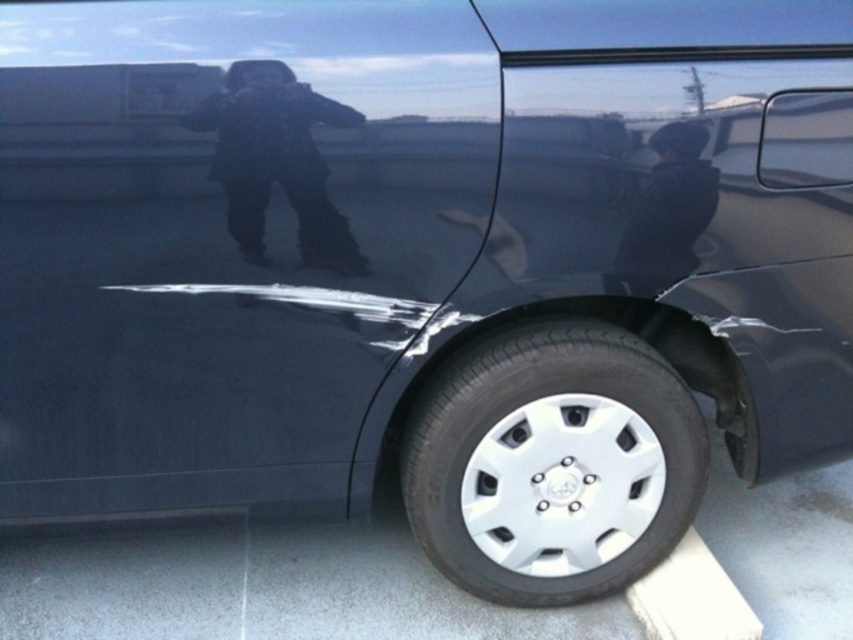
Question: Which object is farther from the camera taking this photo?

Choices:
 (A) silver metallic wheel at lower center
 (B) black textured coat at upper center

Answer: (A)

Question: From the image, what is the correct spatial relationship of black textured coat at upper center in relation to dark gray fabric jacket at lower right?

Choices:
 (A) right
 (B) left

Answer: (B)

Question: Which point is closer to the camera?

Choices:
 (A) dark gray fabric jacket at lower right
 (B) silver metallic wheel at lower center

Answer: (A)

Question: Which point is closer to the camera taking this photo?

Choices:
 (A) (688, 205)
 (B) (541, 580)
 (C) (231, 70)

Answer: (C)

Question: Is silver metallic wheel at lower center below dark gray fabric jacket at lower right?

Choices:
 (A) yes
 (B) no

Answer: (A)

Question: Can you confirm if silver metallic wheel at lower center is positioned to the right of dark gray fabric jacket at lower right?

Choices:
 (A) no
 (B) yes

Answer: (A)